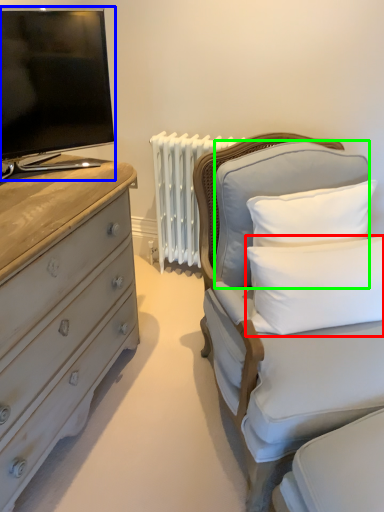
Question: Considering the real-world distances, which object is closest to pillow (highlighted by a red box)? television (highlighted by a blue box) or pillow (highlighted by a green box).

Choices:
 (A) television
 (B) pillow

Answer: (B)